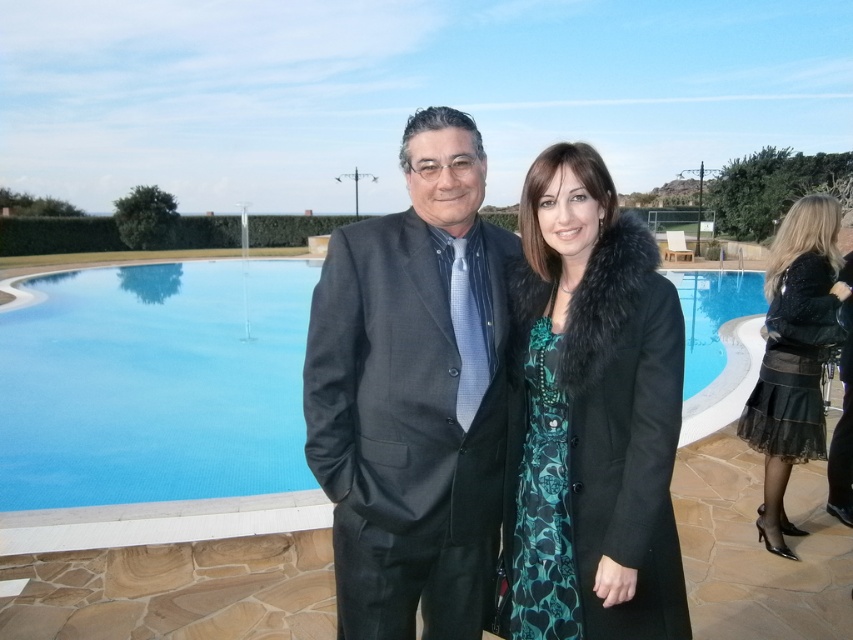
Question: Which object appears closest to the camera in this image?

Choices:
 (A) black fur-trimmed coat at center
 (B) black lace skirt at lower right
 (C) matte black suit at center

Answer: (A)

Question: In this image, where is black fur-trimmed coat at center located relative to black lace skirt at lower right?

Choices:
 (A) above
 (B) below

Answer: (B)

Question: Can you confirm if matte black suit at center is positioned to the left of black fur-trimmed coat at center?

Choices:
 (A) no
 (B) yes

Answer: (B)

Question: Among these points, which one is farthest from the camera?

Choices:
 (A) tap(531, 554)
 (B) tap(770, 316)
 (C) tap(477, 385)

Answer: (B)

Question: Among these points, which one is farthest from the camera?

Choices:
 (A) (595, 451)
 (B) (370, 225)
 (C) (822, 433)

Answer: (C)

Question: Does matte black suit at center have a smaller size compared to black lace skirt at lower right?

Choices:
 (A) no
 (B) yes

Answer: (A)